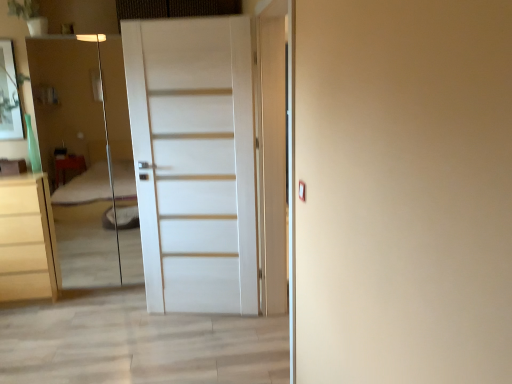
Question: Considering the positions of white matte door at center and matte white chest of drawers at left in the image, is white matte door at center taller or shorter than matte white chest of drawers at left?

Choices:
 (A) tall
 (B) short

Answer: (A)

Question: From the image's perspective, is white matte door at center positioned above or below matte white chest of drawers at left?

Choices:
 (A) below
 (B) above

Answer: (B)

Question: Which of these objects is positioned closest to the matte white chest of drawers at left?

Choices:
 (A) white matte door at center
 (B) transparent glass elevator at left

Answer: (A)

Question: Which object is positioned farthest from the matte white chest of drawers at left?

Choices:
 (A) white matte door at center
 (B) transparent glass elevator at left

Answer: (B)